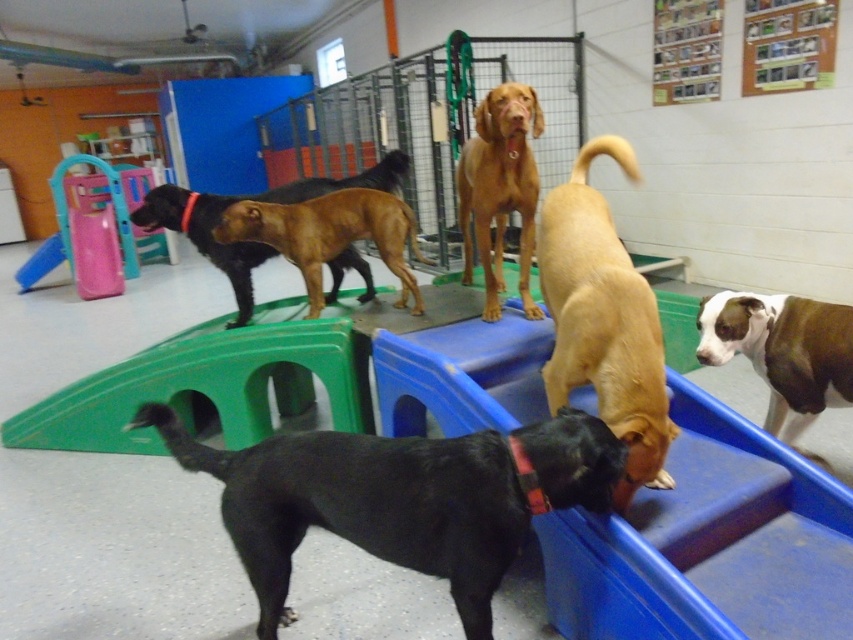
In the scene shown: You are a dog trainer observing the daycare area. You need to locate the light brown fur at center. Based on the coordinates provided, where would you find this dog in relation to the other structures?

The light brown fur at center is located at coordinates point (604, 321), which places it centrally within the daycare area, likely near the middle of the play structures such as ramps or platforms.

You are a dog owner trying to locate your two dogs in the daycare. Your first dog has light brown fur at center and the second is a brown smooth dog at center. Which of your dogs is taller?

The light brown fur at center is taller than the brown smooth dog at center.